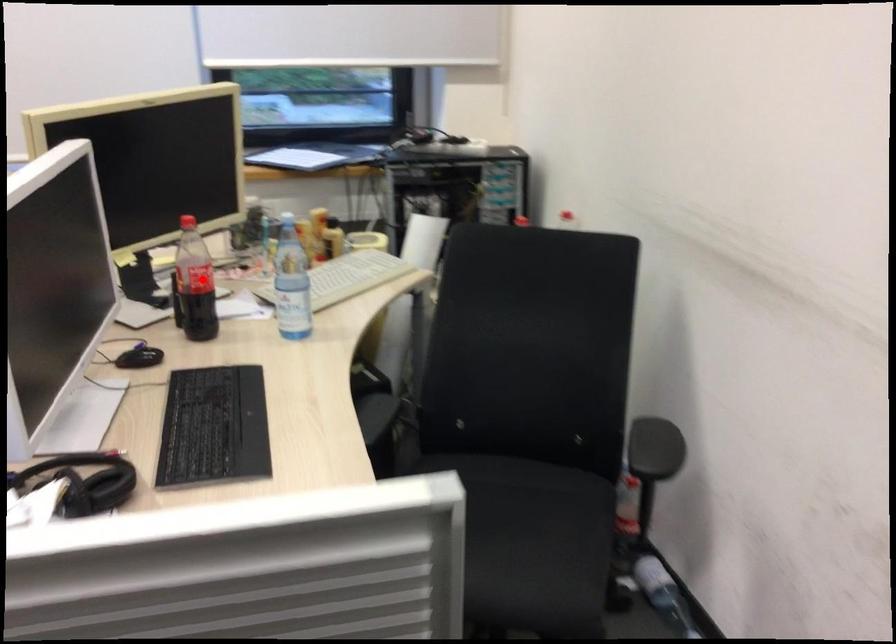
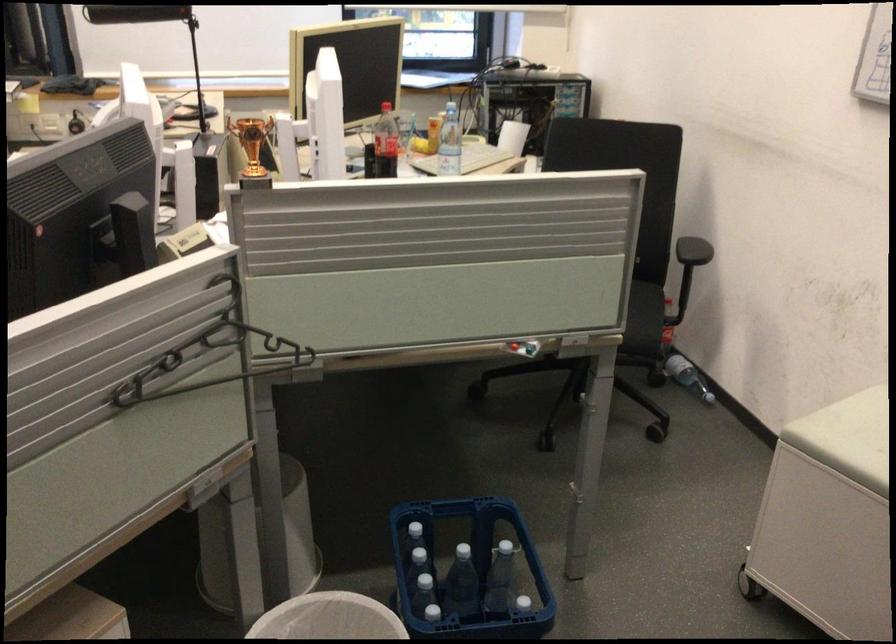
Question: I am providing you with two images of the same scene from different viewpoints. Given a red point in image1, look at the same physical point in image2. Is it:

Choices:
 (A) Closer to the viewpoint
 (B) Farther from the viewpoint

Answer: (B)